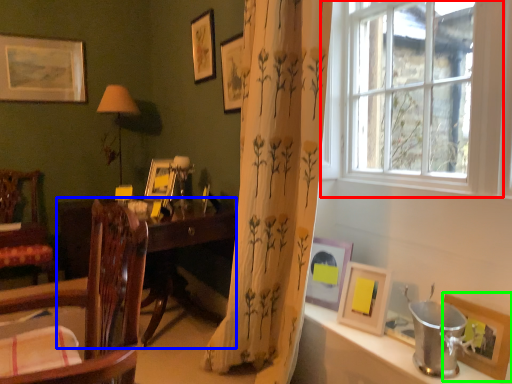
Question: Which object is positioned farthest from window (highlighted by a red box)? Select from desk (highlighted by a blue box) and picture frame (highlighted by a green box).

Choices:
 (A) desk
 (B) picture frame

Answer: (A)